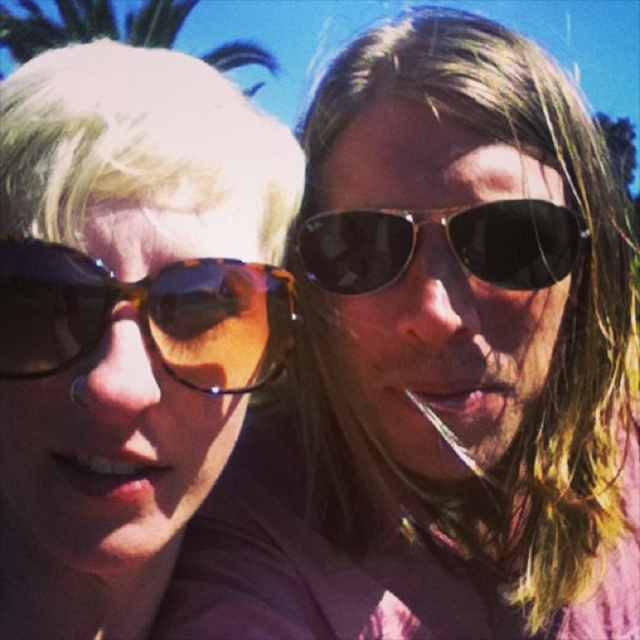
Does matte tortoiseshell sunglasses at left have a larger size compared to green leafy palm tree at upper left?

No, matte tortoiseshell sunglasses at left is not bigger than green leafy palm tree at upper left.

Between point (148, 353) and point (241, 44), which one is positioned in front?

Point (148, 353) is more forward.

Between point (28, 401) and point (262, 52), which one is positioned in front?

Point (28, 401) is more forward.

Find the location of a particular element. Image resolution: width=640 pixels, height=640 pixels. matte tortoiseshell sunglasses at left is located at coordinates (125, 320).

Does matte tortoiseshell sunglasses at left have a larger size compared to black reflective sunglasses at center?

Yes, matte tortoiseshell sunglasses at left is bigger than black reflective sunglasses at center.

Who is more distant from viewer, (83,440) or (369,284)?

The point (369,284) is more distant.

At what (x,y) coordinates should I click in order to perform the action: click on matte tortoiseshell sunglasses at left. Please return your answer as a coordinate pair (x, y). Looking at the image, I should click on (125, 320).

Is point (138, 310) positioned before point (305, 273)?

Yes, it is in front of point (305, 273).

Can you confirm if tortoiseshell sunglasses at left is positioned above black reflective sunglasses at center?

No.

Between point (28, 374) and point (545, 250), which one is positioned in front?

Point (28, 374) is more forward.

I want to click on tortoiseshell sunglasses at left, so click(145, 314).